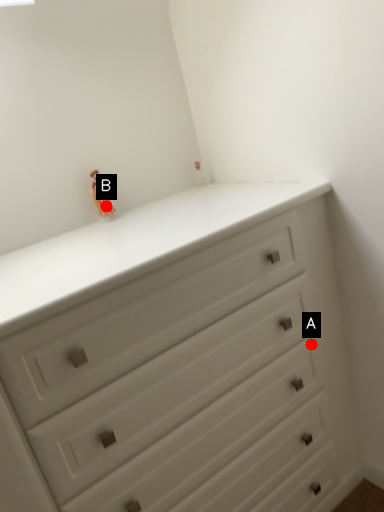
Question: Two points are circled on the image, labeled by A and B beside each circle. Among these points, which one is farthest from the camera?

Choices:
 (A) A is further
 (B) B is further

Answer: (B)